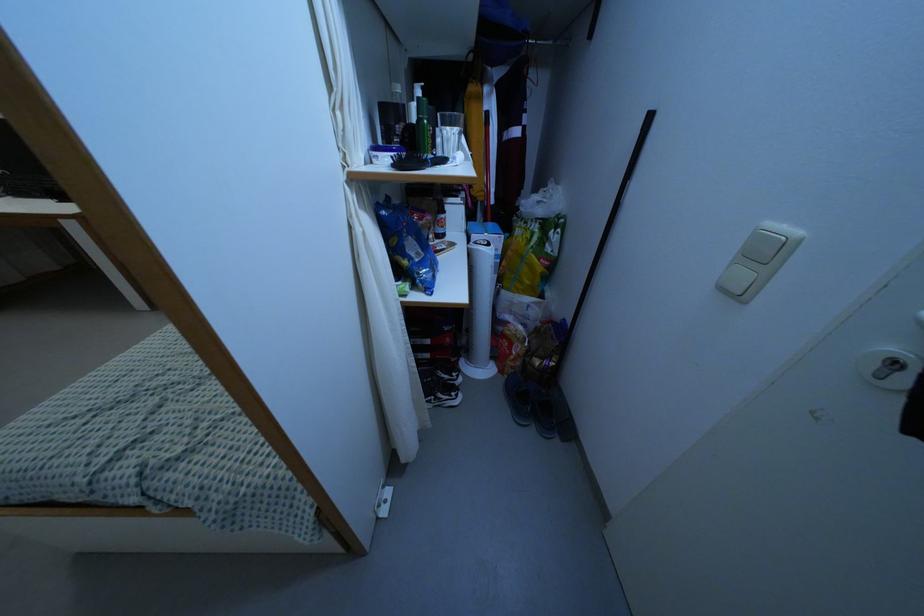
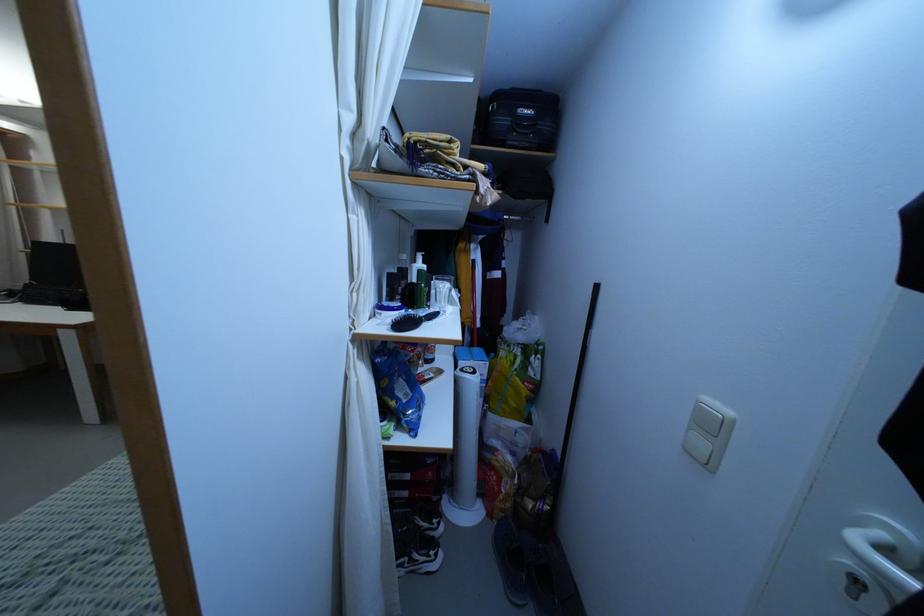
Question: What movement of the cameraman would produce the second image?

Choices:
 (A) Left
 (B) Right
 (C) Forward
 (D) Backward

Answer: (D)